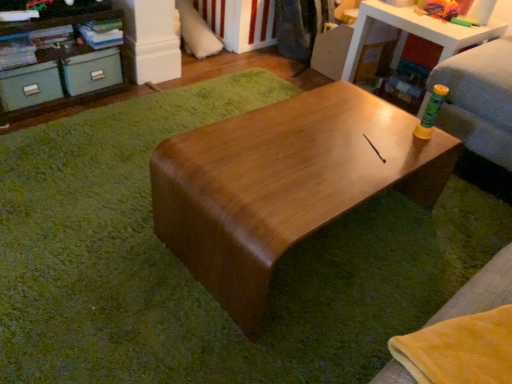
Question: Does matte green drawer at left, the 1th drawer from the right, appear on the left side of shiny brown table at upper right, marked as the 1th table in a right-to-left arrangement?

Choices:
 (A) yes
 (B) no

Answer: (A)

Question: From a real-world perspective, is matte green drawer at left, the 2th drawer in the left-to-right sequence, under shiny brown table at upper right, the second table positioned from the bottom?

Choices:
 (A) no
 (B) yes

Answer: (B)

Question: Is matte green drawer at left, the 2th drawer in the left-to-right sequence, positioned far away from shiny brown table at upper right, which appears as the second table when viewed from the front?

Choices:
 (A) yes
 (B) no

Answer: (A)

Question: From the image's perspective, is matte green drawer at left, the 1th drawer from the right, under shiny brown table at upper right, acting as the second table starting from the left?

Choices:
 (A) no
 (B) yes

Answer: (B)

Question: Is matte green drawer at left, the 2th drawer in the left-to-right sequence, oriented away from shiny brown table at upper right, marked as the 1th table in a right-to-left arrangement?

Choices:
 (A) yes
 (B) no

Answer: (B)

Question: Based on their positions, is matte teal storage boxes at upper left located to the left or right of matte green drawer at left, the 1th drawer from the right?

Choices:
 (A) right
 (B) left

Answer: (B)

Question: Is matte teal storage boxes at upper left inside or outside of matte green drawer at left, the 1th drawer from the right?

Choices:
 (A) inside
 (B) outside

Answer: (B)

Question: In the image, is matte teal storage boxes at upper left positioned in front of or behind matte green drawer at left, the 1th drawer from the right?

Choices:
 (A) behind
 (B) front

Answer: (B)

Question: From a real-world perspective, is matte teal storage boxes at upper left above or below matte green drawer at left, the 2th drawer in the left-to-right sequence?

Choices:
 (A) above
 (B) below

Answer: (A)

Question: In the image, is matte green drawer at left, acting as the 2th drawer starting from the right, on the left side or the right side of shiny brown table at center, the first table from the front?

Choices:
 (A) left
 (B) right

Answer: (A)

Question: In terms of height, does matte green drawer at left, the first drawer positioned from the left, look taller or shorter compared to shiny brown table at center, the first table from the front?

Choices:
 (A) short
 (B) tall

Answer: (A)

Question: In terms of width, does matte green drawer at left, acting as the 2th drawer starting from the right, look wider or thinner when compared to shiny brown table at center, placed as the 2th table when sorted from back to front?

Choices:
 (A) wide
 (B) thin

Answer: (B)

Question: Is matte green drawer at left, acting as the 2th drawer starting from the right, spatially inside shiny brown table at center, the 1th table when ordered from left to right, or outside of it?

Choices:
 (A) inside
 (B) outside

Answer: (B)

Question: Does point (58, 91) appear closer or farther from the camera than point (459, 26)?

Choices:
 (A) closer
 (B) farther

Answer: (A)

Question: Is matte green drawer at left, the first drawer positioned from the left, to the left or to the right of shiny brown table at upper right, acting as the second table starting from the left, in the image?

Choices:
 (A) right
 (B) left

Answer: (B)